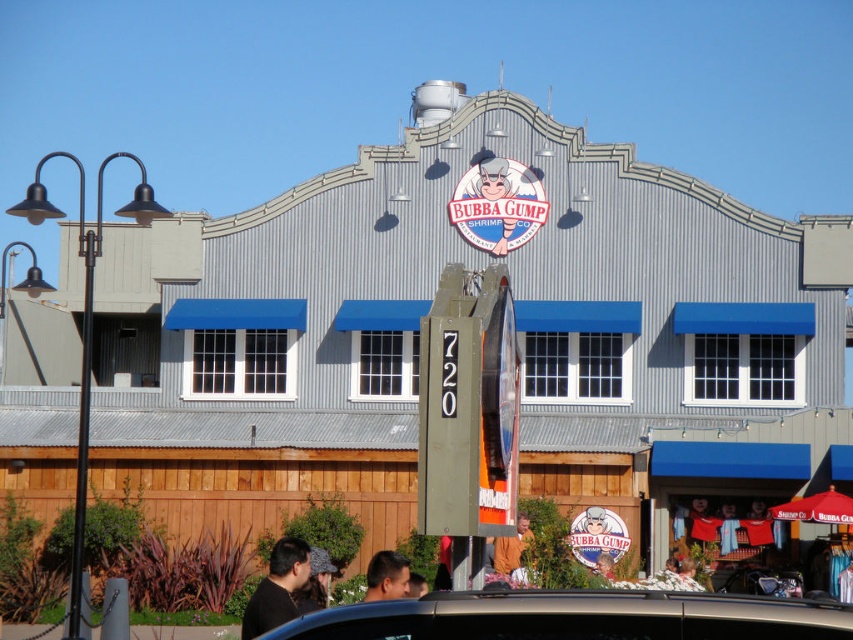
You are standing at the entrance of the Bubba Gump Shrimp Co. building and notice a point marked at coordinates (575,616). Which object does this point correspond to?

The point at coordinates (575,616) corresponds to the metallic gray car at lower center.

You are a pedestrian standing on the sidewalk in front of the Bubba Gump Shrimp Co. building. You see a metallic gray car at lower center and a smooth black hair at center. Which object is closer to the street signpost with the number 720?

The metallic gray car at lower center is located above smooth black hair at center, so the smooth black hair at center is closer to the street signpost with the number 720.

In the scene shown: You are a delivery person trying to park your van in front of the Bubba Gump Shrimp Co. The van is 2 meters wide. There is a black matte shirt at lower left and a matte plastic sign at center on the ground. Can you park between them without hitting either object?

The black matte shirt at lower left might be wider than matte plastic sign at center, so it is uncertain if the van can fit between them. Check the actual width before parking.